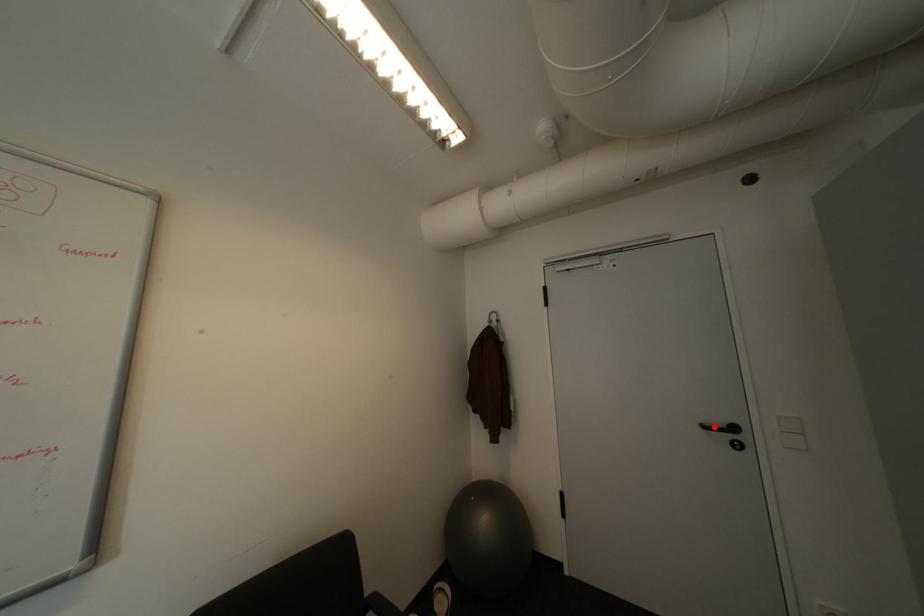
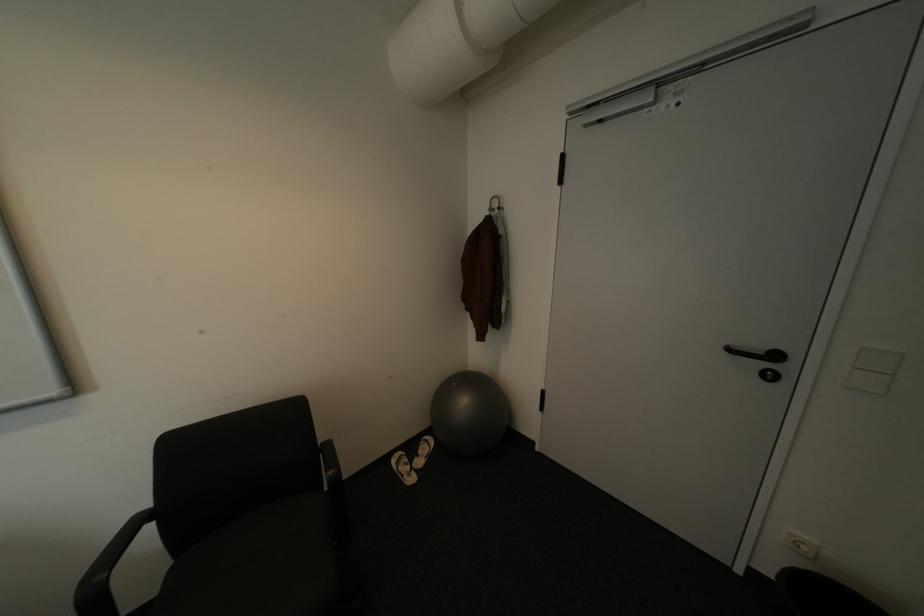
Find the pixel in the second image that matches the highlighted location in the first image.

(739, 350)